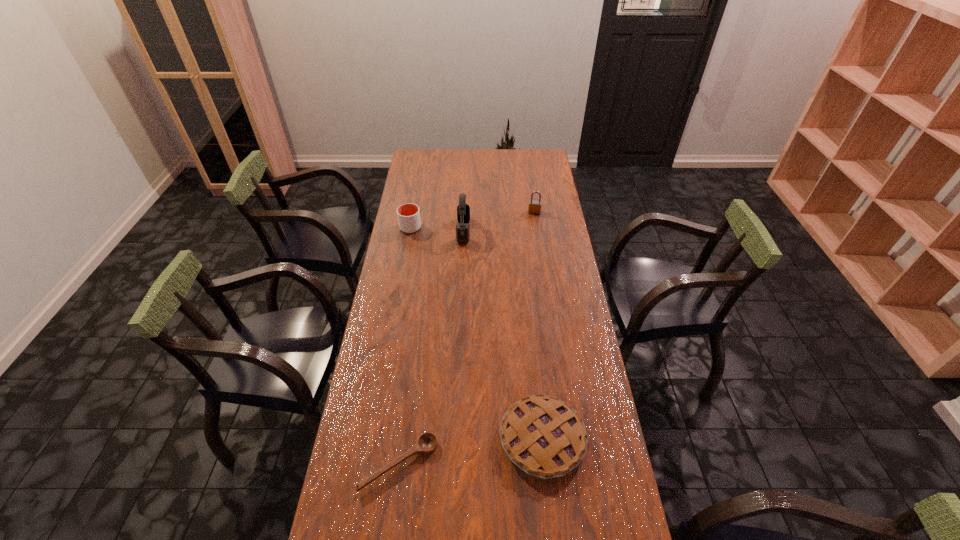
Where is `blank area in the image that satisfies the following two spatial constraints: 1. on the headband of the tallest object; 2. on the front side of the wooden spoon`? The width and height of the screenshot is (960, 540). blank area in the image that satisfies the following two spatial constraints: 1. on the headband of the tallest object; 2. on the front side of the wooden spoon is located at coordinates (453, 464).